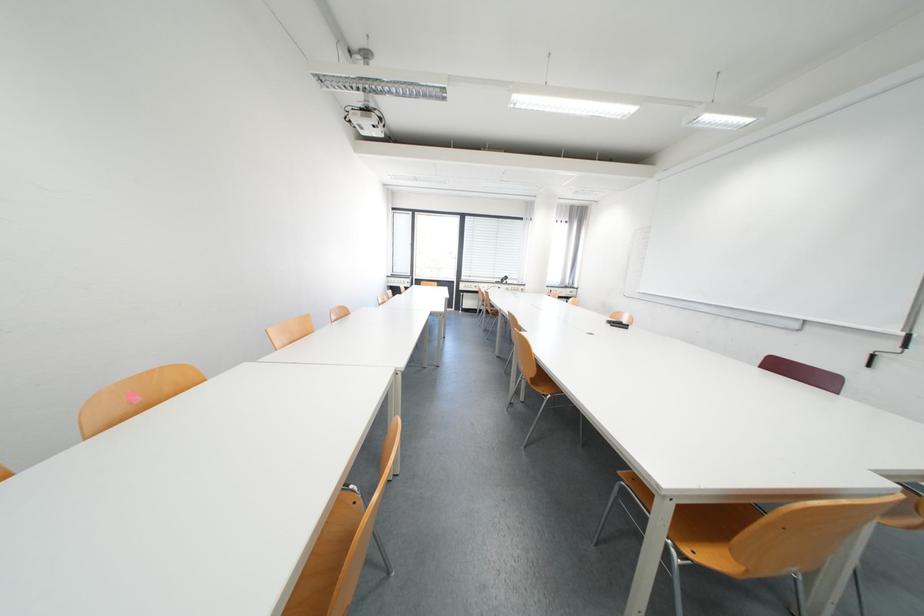
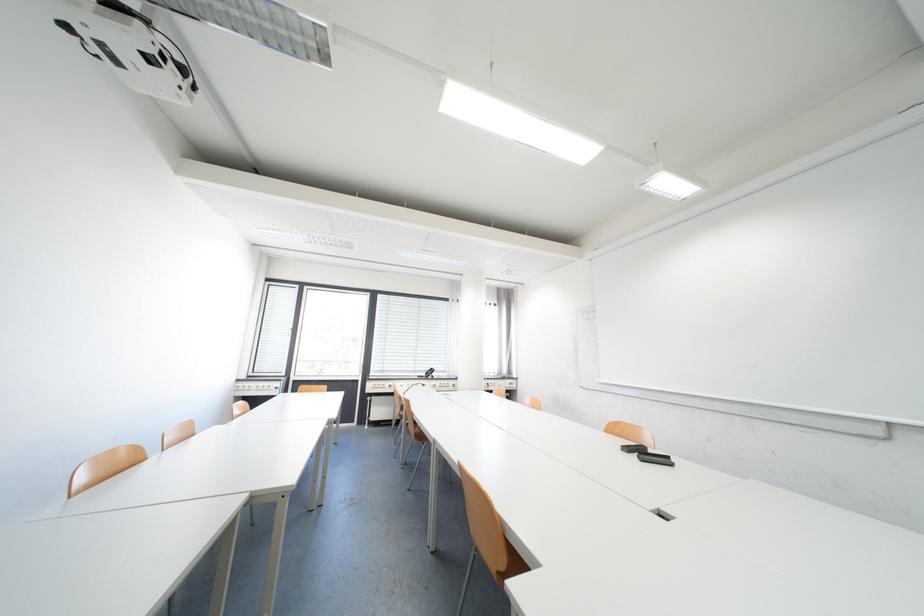
Find the pixel in the second image that matches pixel 626 325 in the first image.

(652, 454)